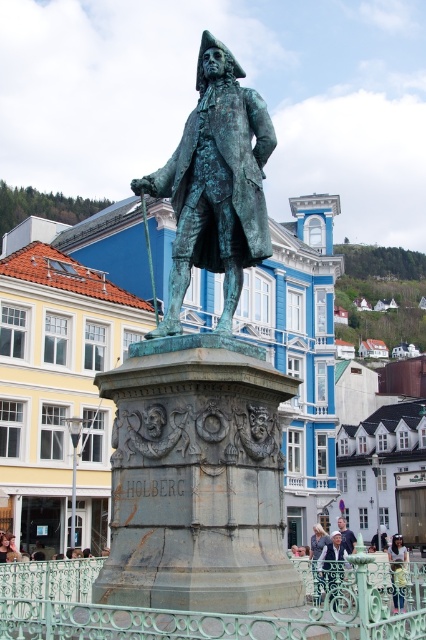
Is light blue fabric jacket at lower center taller than light brown leather jacket at center?

Incorrect, light blue fabric jacket at lower center's height is not larger of light brown leather jacket at center's.

Who is more distant from viewer, (342, 564) or (397, 538)?

The point (397, 538) is more distant.

Where is `light blue fabric jacket at lower center`? The width and height of the screenshot is (426, 640). light blue fabric jacket at lower center is located at coordinates (333, 564).

Can you confirm if green patina statue at center is thinner than bronze statue at center?

In fact, green patina statue at center might be wider than bronze statue at center.

Is green patina statue at center below bronze statue at center?

Indeed, green patina statue at center is positioned under bronze statue at center.

The width and height of the screenshot is (426, 640). In order to click on green patina statue at center in this screenshot , I will do click(x=203, y=387).

Does green wrought iron railing at center appear over light brown leather jacket at center?

Yes.

Is point (396, 627) farther from camera compared to point (393, 576)?

No, it is in front of (393, 576).

Is point (416, 627) farther from viewer compared to point (402, 564)?

No.

Identify the location of green wrought iron railing at center. (207, 612).